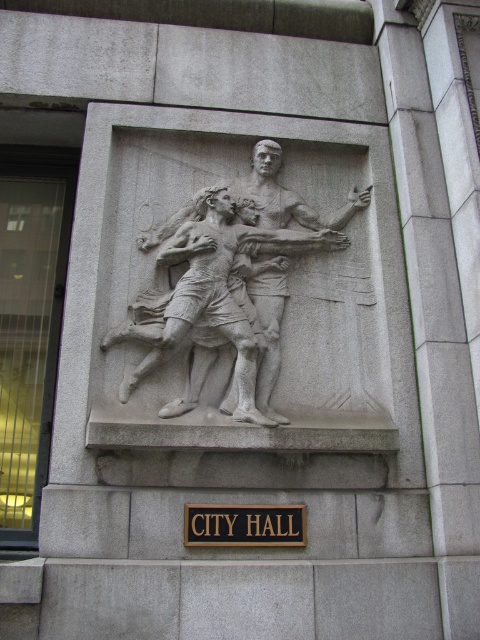
Is gray stone relief at center below black wood sign at center?

Actually, gray stone relief at center is above black wood sign at center.

Does gray stone relief at center appear over black wood sign at center?

Yes.

Which is behind, point (275, 294) or point (212, 515)?

The point (275, 294) is behind.

I want to click on gray stone relief at center, so click(x=228, y=285).